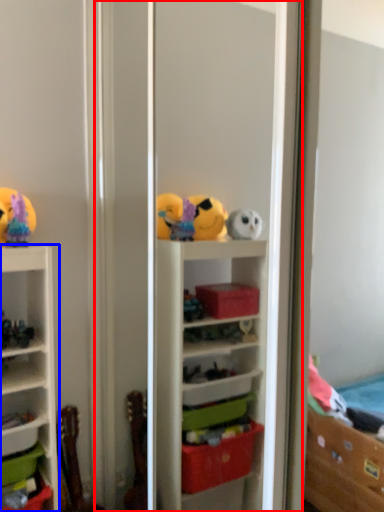
Question: Which object is closer to the camera taking this photo, screen door (highlighted by a red box) or shelf (highlighted by a blue box)?

Choices:
 (A) screen door
 (B) shelf

Answer: (A)